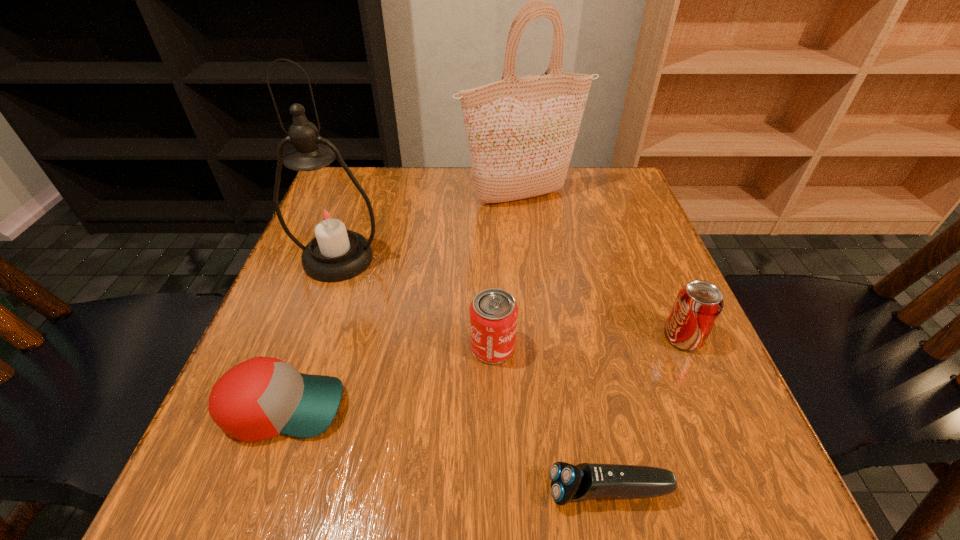
The height and width of the screenshot is (540, 960). I want to click on vacant space at the near right corner of the desktop, so click(680, 465).

Locate an element on the screen. The height and width of the screenshot is (540, 960). unoccupied position between the rightmost object and the farthest object is located at coordinates click(602, 268).

The image size is (960, 540). Find the location of `free space between the oil lamp and the can`. free space between the oil lamp and the can is located at coordinates (416, 303).

The height and width of the screenshot is (540, 960). In order to click on free space between the baseball cap and the can in this screenshot , I will do `click(388, 377)`.

Locate an element on the screen. Image resolution: width=960 pixels, height=540 pixels. vacant point located between the shopping bag and the fifth nearest object is located at coordinates (429, 228).

The width and height of the screenshot is (960, 540). What are the coordinates of `vacant space that is in between the shopping bag and the soda can` in the screenshot? It's located at pyautogui.click(x=602, y=268).

Identify the location of empty space between the second nearest object and the can. (388, 377).

Locate an element on the screen. free space between the oil lamp and the baseball cap is located at coordinates tap(311, 333).

Image resolution: width=960 pixels, height=540 pixels. I want to click on free space between the shortest object and the can, so click(x=551, y=420).

Find the location of a particular element. The image size is (960, 540). empty space that is in between the fifth nearest object and the can is located at coordinates (416, 303).